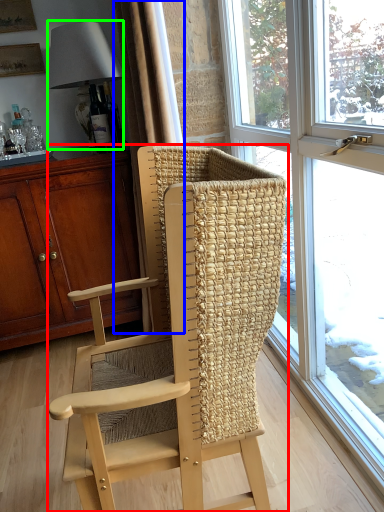
Question: Which is nearer to the chair (highlighted by a red box)? curtain (highlighted by a blue box) or lamp (highlighted by a green box).

Choices:
 (A) curtain
 (B) lamp

Answer: (A)